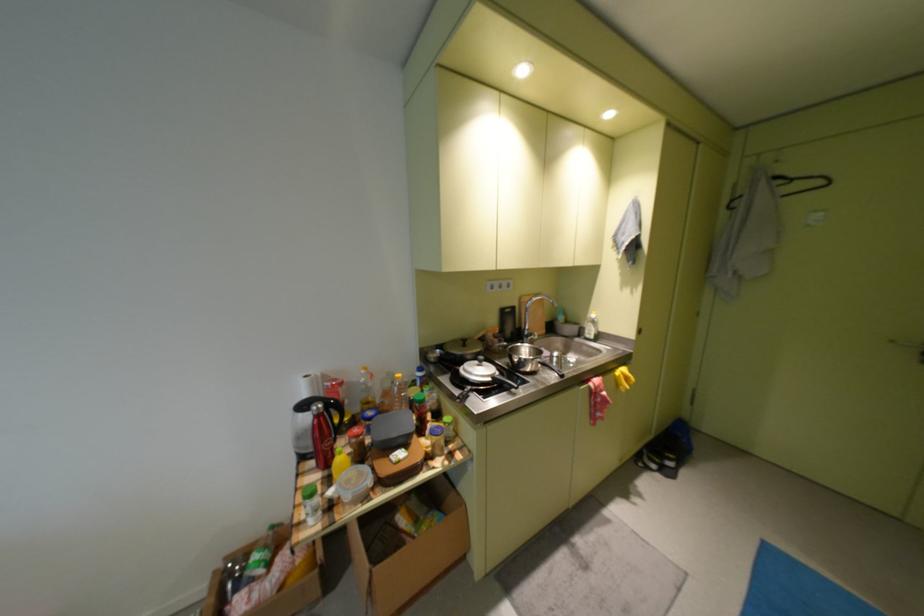
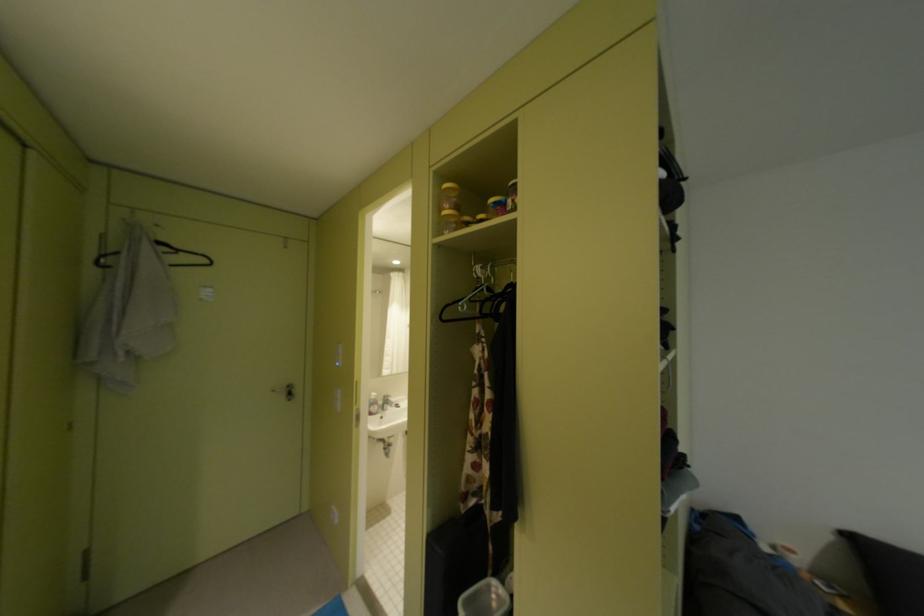
The point at (819, 227) is marked in the first image. Where is the corresponding point in the second image?

(212, 301)